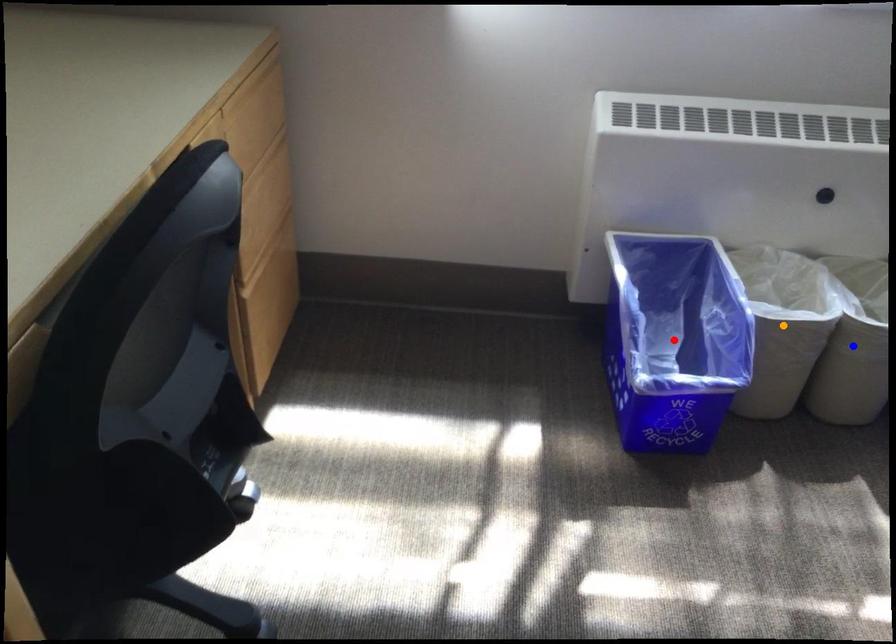
Order these from nearest to farthest:
orange point | red point | blue point

orange point, blue point, red point